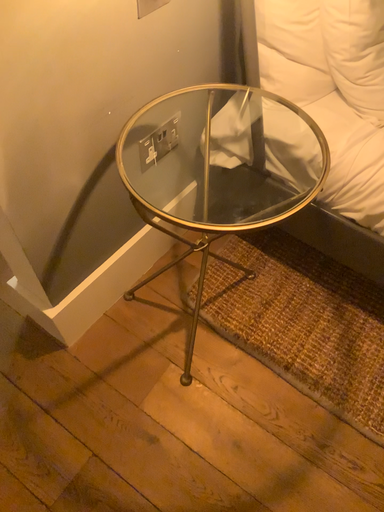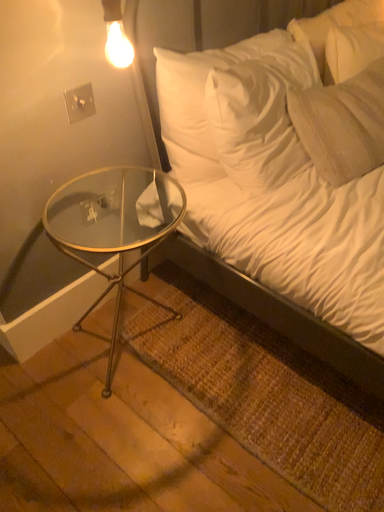
Question: Which way did the camera rotate in the video?

Choices:
 (A) rotated downward
 (B) rotated upward

Answer: (B)